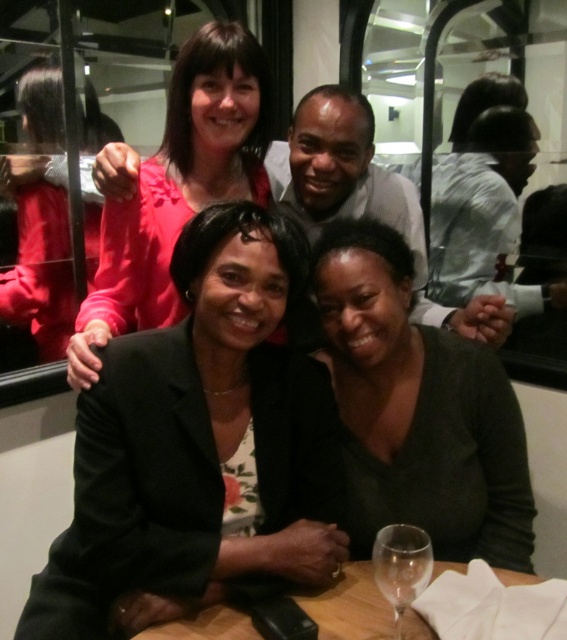
Looking at this image, between dark green sweater at center and transparent glass at lower center, which one has more height?

dark green sweater at center

What are the coordinates of `dark green sweater at center` in the screenshot? It's located at (418, 410).

Image resolution: width=567 pixels, height=640 pixels. Find the location of `dark green sweater at center`. dark green sweater at center is located at coordinates (418, 410).

Which is more to the right, white shirt at upper center or transparent glass at lower center?

From the viewer's perspective, white shirt at upper center appears more on the right side.

Is point (418, 205) farther from viewer compared to point (404, 577)?

Yes, point (418, 205) is farther from viewer.

Which is in front, point (437, 310) or point (403, 557)?

Point (403, 557)

Where is `white shirt at upper center`? This screenshot has height=640, width=567. white shirt at upper center is located at coordinates (365, 196).

Can you confirm if white shirt at upper center is positioned to the right of matte pink sweater at upper left?

Correct, you'll find white shirt at upper center to the right of matte pink sweater at upper left.

Who is higher up, white shirt at upper center or matte pink sweater at upper left?

Positioned higher is matte pink sweater at upper left.

Is point (302, 124) positioned behind point (95, 240)?

No, (302, 124) is closer to viewer.

Find the location of a particular element. The height and width of the screenshot is (640, 567). white shirt at upper center is located at coordinates (365, 196).